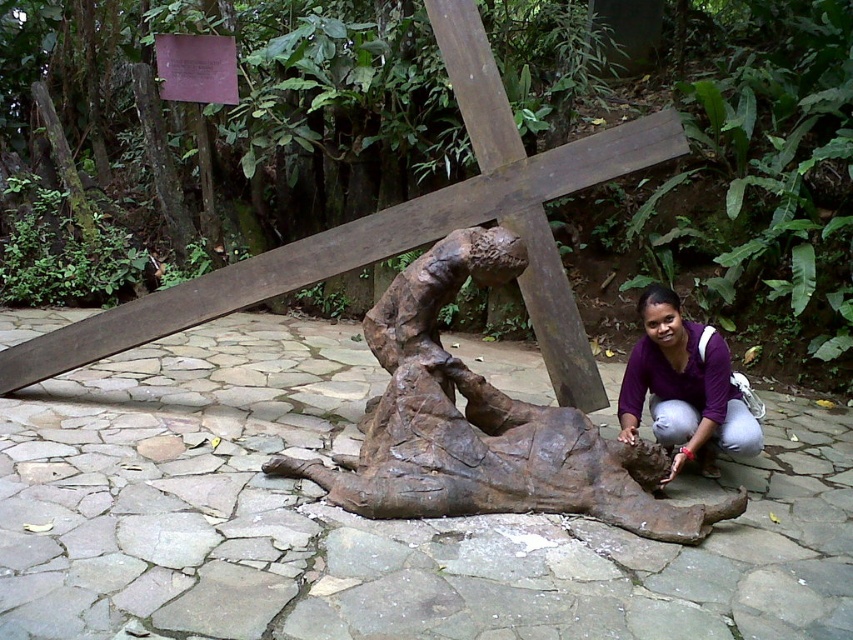
Question: Which of the following is the closest to the observer?

Choices:
 (A) rusty wood crucifix at center
 (B) rusty metal sculpture at center

Answer: (B)

Question: Can you confirm if rusty metal sculpture at center is positioned below rusty wood crucifix at center?

Choices:
 (A) no
 (B) yes

Answer: (B)

Question: Considering the relative positions of rusty metal sculpture at center and rusty wood crucifix at center in the image provided, where is rusty metal sculpture at center located with respect to rusty wood crucifix at center?

Choices:
 (A) right
 (B) left

Answer: (A)

Question: Which point appears farthest from the camera in this image?

Choices:
 (A) tap(714, 381)
 (B) tap(579, 493)

Answer: (A)

Question: Does rusty metal sculpture at center have a larger size compared to purple matte shirt at lower right?

Choices:
 (A) yes
 (B) no

Answer: (A)

Question: Among these points, which one is nearest to the camera?

Choices:
 (A) (451, 243)
 (B) (709, 381)

Answer: (A)